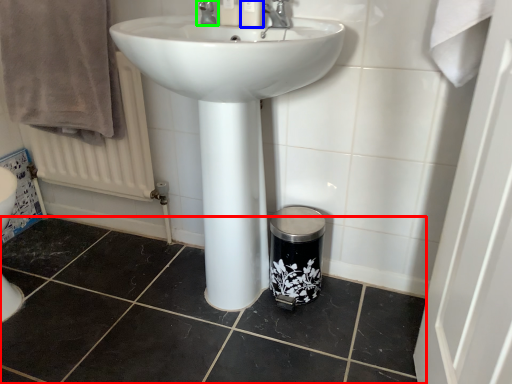
Question: Based on their relative distances, which object is nearer to tile (highlighted by a red box)? Choose from toiletry (highlighted by a blue box) and tap (highlighted by a green box).

Choices:
 (A) toiletry
 (B) tap

Answer: (B)